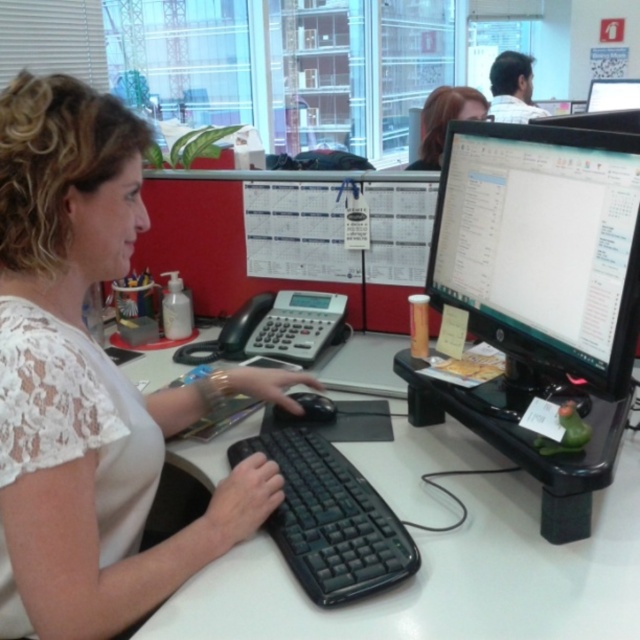
You are a new employee in the office and need to place a sticky note on the object that is taller between the matte black monitor at upper right and the black matte mouse at center. Which object should you choose?

The matte black monitor at upper right is much taller than the black matte mouse at center, so you should place the sticky note on the matte black monitor at upper right.

You are an office assistant who needs to deliver a message to the woman. You see the white lace blouse at center and the matte black monitor at center. Which object is closer to you as you approach her desk?

The white lace blouse at center is closer to you than the matte black monitor at center.

You are a delivery robot entering an office and need to place a package on the desk. The desk has a matte black monitor at upper right and a black matte mouse at center. Where should you place the package so it doesn not block the monitor or the mouse?

The black matte mouse at center is behind the matte black monitor at upper right, so placing the package in front of the monitor, away from the mouse, would avoid blocking either object.